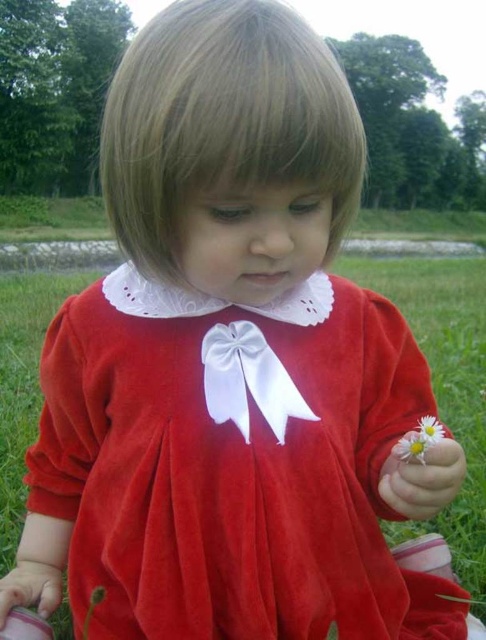
Is white satin bow at center to the right of white matte flower at lower right from the viewer's perspective?

No, white satin bow at center is not to the right of white matte flower at lower right.

Between white satin bow at center and white matte flower at lower right, which one appears on the right side from the viewer's perspective?

white matte flower at lower right is more to the right.

What are the coordinates of `white satin bow at center` in the screenshot? It's located at (247, 380).

What do you see at coordinates (231, 464) in the screenshot? The image size is (486, 640). I see `velvet red dress at center` at bounding box center [231, 464].

Is velvet red dress at center taller than white soft flower at lower right?

Yes.

Does point (273, 632) come in front of point (409, 449)?

No, it is not.

This screenshot has height=640, width=486. Find the location of `velvet red dress at center`. velvet red dress at center is located at coordinates (231, 464).

Looking at this image, is white soft flower at lower right positioned in front of white matte flower at lower right?

Yes.

Identify the location of white soft flower at lower right. This screenshot has height=640, width=486. (415, 444).